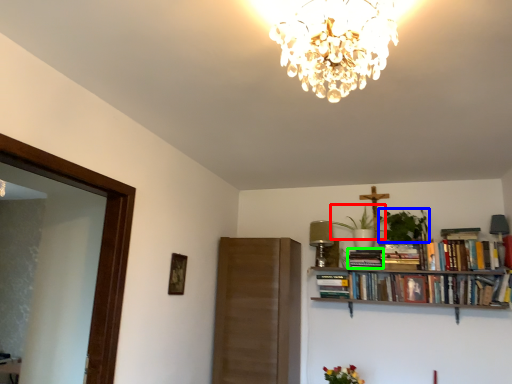
Question: Estimate the real-world distances between objects in this image. Which object is farther from plant (highlighted by a red box), plant (highlighted by a blue box) or book (highlighted by a green box)?

Choices:
 (A) plant
 (B) book

Answer: (B)